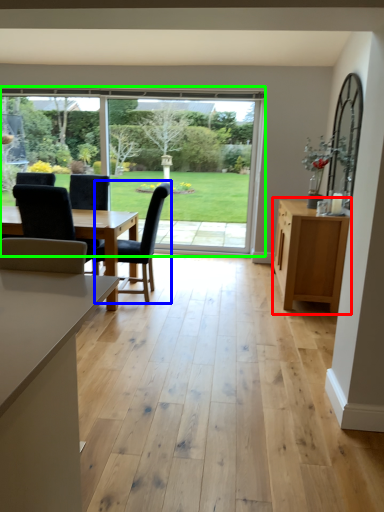
Question: Estimate the real-world distances between objects in this image. Which object is farther from cabinetry (highlighted by a red box), chair (highlighted by a blue box) or window (highlighted by a green box)?

Choices:
 (A) chair
 (B) window

Answer: (B)